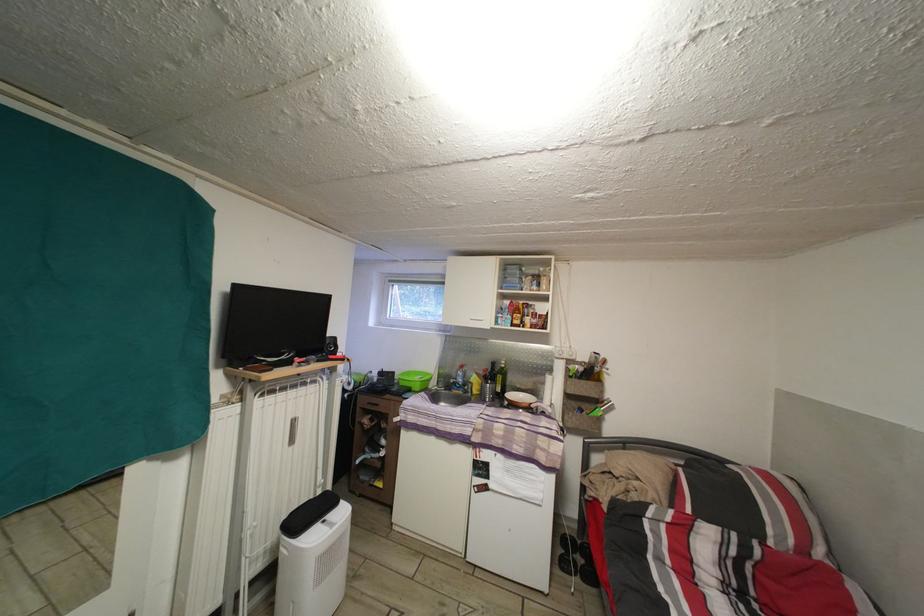
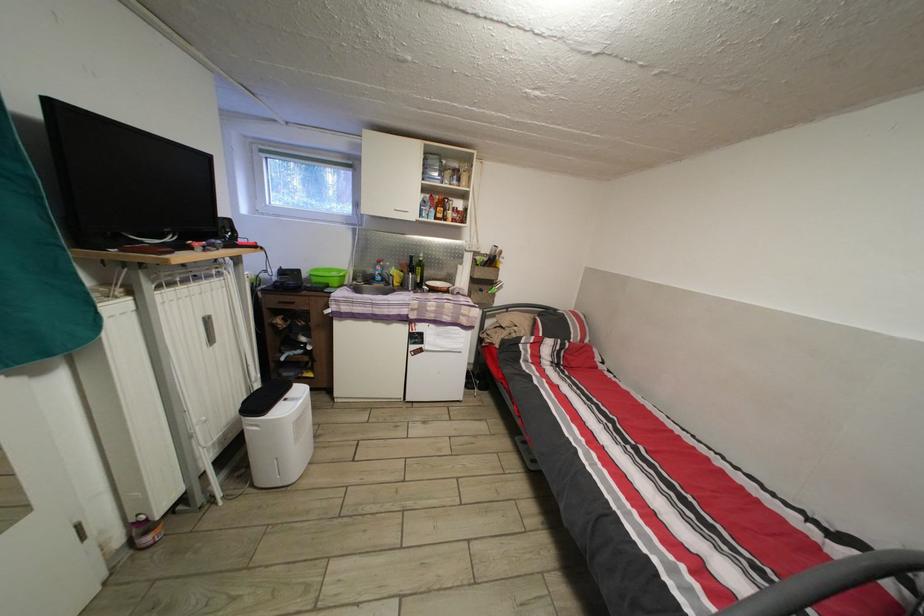
In the second image, find the point that corresponds to (x=298, y=400) in the first image.

(201, 294)